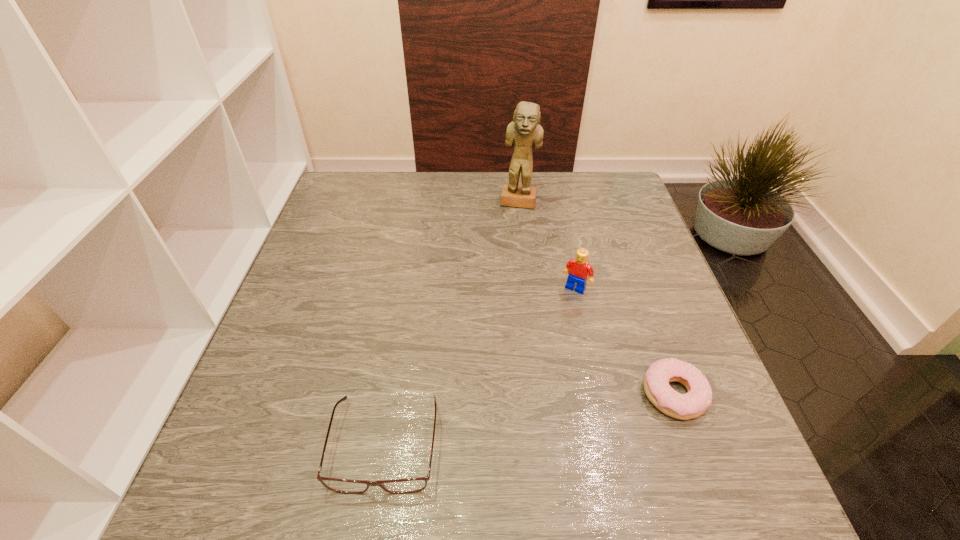
Identify the location of vacant area situated 0.370m on the front-facing side of the tallest object. (506, 306).

Locate an element on the screen. free region located on the front-facing side of the tallest object is located at coordinates (512, 256).

Find the location of `free spot located 0.400m on the front-facing side of the tallest object`. free spot located 0.400m on the front-facing side of the tallest object is located at coordinates 505,315.

At what (x,y) coordinates should I click in order to perform the action: click on object that is at the far edge. Please return your answer as a coordinate pair (x, y). Looking at the image, I should click on (525, 131).

Find the location of a particular element. The height and width of the screenshot is (540, 960). spectacles situated at the near edge is located at coordinates (408, 485).

Image resolution: width=960 pixels, height=540 pixels. I want to click on doughnut that is at the near edge, so click(694, 403).

Locate an element on the screen. object that is at the right edge is located at coordinates (694, 403).

The width and height of the screenshot is (960, 540). Find the location of `object that is positioned at the near right corner`. object that is positioned at the near right corner is located at coordinates (694, 403).

I want to click on free spot at the far edge of the desktop, so click(558, 200).

At what (x,y) coordinates should I click in order to perform the action: click on free spot at the near edge of the desktop. Please return your answer as a coordinate pair (x, y). Image resolution: width=960 pixels, height=540 pixels. Looking at the image, I should click on (447, 422).